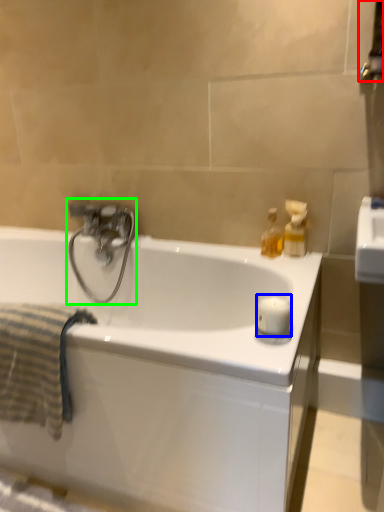
Question: Which object is the closest to the towel bar (highlighted by a red box)? Choose among these: candle (highlighted by a blue box) or tap (highlighted by a green box).

Choices:
 (A) candle
 (B) tap

Answer: (A)